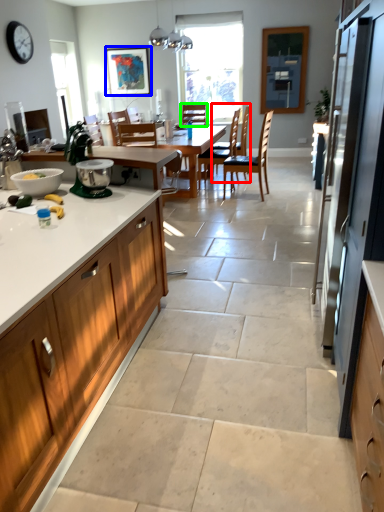
Question: Which object is the closest to the chair (highlighted by a red box)? Choose among these: picture frame (highlighted by a blue box) or chair (highlighted by a green box).

Choices:
 (A) picture frame
 (B) chair

Answer: (B)